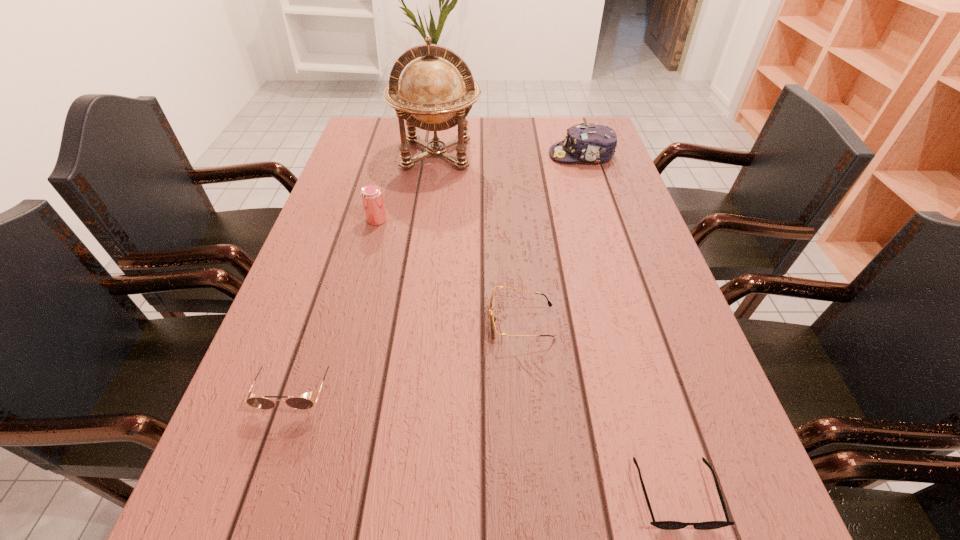
The width and height of the screenshot is (960, 540). What are the coordinates of `free space between the fourth nearest object and the tallest sunglasses` in the screenshot? It's located at (336, 304).

The height and width of the screenshot is (540, 960). In order to click on free space that is in between the nearest object and the globe in this screenshot , I will do coord(557,323).

Identify the location of object that is the fifth closest to the tallest sunglasses. (596, 143).

Select which object is the fourth closest to the headwear. Please provide its 2D coordinates. Your answer should be formatted as a tuple, i.e. [(x, y)], where the tuple contains the x and y coordinates of a point satisfying the conditions above.

[(300, 403)]

You are a GUI agent. You are given a task and a screenshot of the screen. Output one action in this format:
    pyautogui.click(x=<x>, y=<y>)
    Task: Click on the sunglasses that is the second closest to the second farthest sunglasses
    The image size is (960, 540).
    Given the screenshot: What is the action you would take?
    (666, 525)

Identify which sunglasses is the second closest to the fourth object from left to right. Please provide its 2D coordinates. Your answer should be formatted as a tuple, i.e. [(x, y)], where the tuple contains the x and y coordinates of a point satisfying the conditions above.

[(300, 403)]

You are a GUI agent. You are given a task and a screenshot of the screen. Output one action in this format:
    pyautogui.click(x=<x>, y=<y>)
    Task: Click on the blank space that satisfies the following two spatial constraints: 1. on the front-facing side of the headwear; 2. on the front lenses of the fourth tallest object
    The height and width of the screenshot is (540, 960).
    Given the screenshot: What is the action you would take?
    pyautogui.click(x=657, y=388)

Locate an element on the screen. The width and height of the screenshot is (960, 540). blank area in the image that satisfies the following two spatial constraints: 1. on the front-facing side of the headwear; 2. on the front lenses of the third shortest object is located at coordinates [x=657, y=388].

You are a GUI agent. You are given a task and a screenshot of the screen. Output one action in this format:
    pyautogui.click(x=<x>, y=<y>)
    Task: Click on the blank space that satisfies the following two spatial constraints: 1. on the lenses of the second sunglasses from right to left; 2. on the front lenses of the fourth tallest object
    Image resolution: width=960 pixels, height=540 pixels.
    Given the screenshot: What is the action you would take?
    pyautogui.click(x=527, y=388)